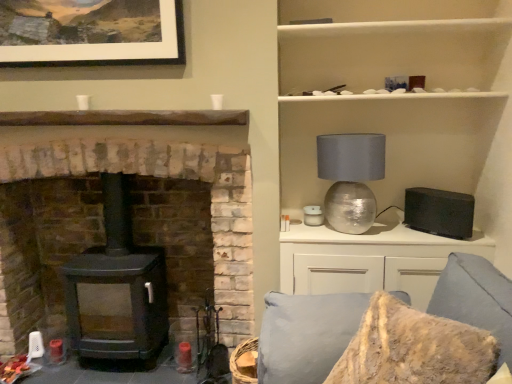
Question: Does white matte cabinet at upper right have a lesser height compared to matte black wood stove at left?

Choices:
 (A) yes
 (B) no

Answer: (A)

Question: Is white matte cabinet at upper right behind matte black wood stove at left?

Choices:
 (A) yes
 (B) no

Answer: (B)

Question: Is white matte cabinet at upper right positioned before matte black wood stove at left?

Choices:
 (A) yes
 (B) no

Answer: (A)

Question: Are white matte cabinet at upper right and matte black wood stove at left making contact?

Choices:
 (A) yes
 (B) no

Answer: (B)

Question: Is white matte cabinet at upper right at the right side of matte black wood stove at left?

Choices:
 (A) no
 (B) yes

Answer: (B)

Question: From a real-world perspective, is white matte cabinet at upper right positioned under matte black wood stove at left based on gravity?

Choices:
 (A) yes
 (B) no

Answer: (B)

Question: Does white glossy cabinet at upper right appear on the left side of white matte cabinet at upper right?

Choices:
 (A) yes
 (B) no

Answer: (B)

Question: Is white glossy cabinet at upper right next to white matte cabinet at upper right and touching it?

Choices:
 (A) yes
 (B) no

Answer: (B)

Question: From a real-world perspective, is white glossy cabinet at upper right below white matte cabinet at upper right?

Choices:
 (A) no
 (B) yes

Answer: (B)

Question: From the image's perspective, is white glossy cabinet at upper right under white matte cabinet at upper right?

Choices:
 (A) no
 (B) yes

Answer: (B)

Question: Is white glossy cabinet at upper right behind white matte cabinet at upper right?

Choices:
 (A) yes
 (B) no

Answer: (A)

Question: Can you confirm if white glossy cabinet at upper right is smaller than white matte cabinet at upper right?

Choices:
 (A) yes
 (B) no

Answer: (A)

Question: Is black matte speaker at right closer to the viewer compared to matte black wood stove at left?

Choices:
 (A) no
 (B) yes

Answer: (A)